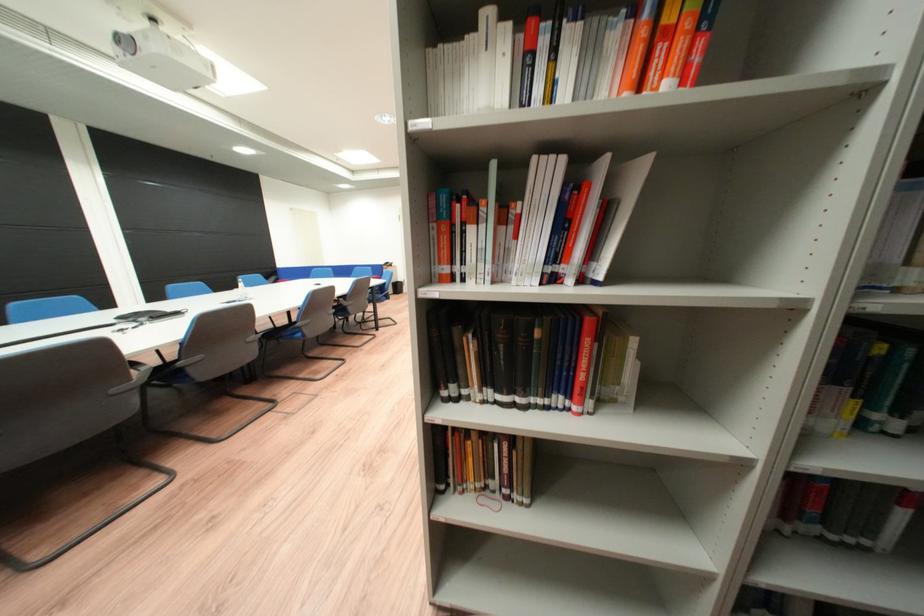
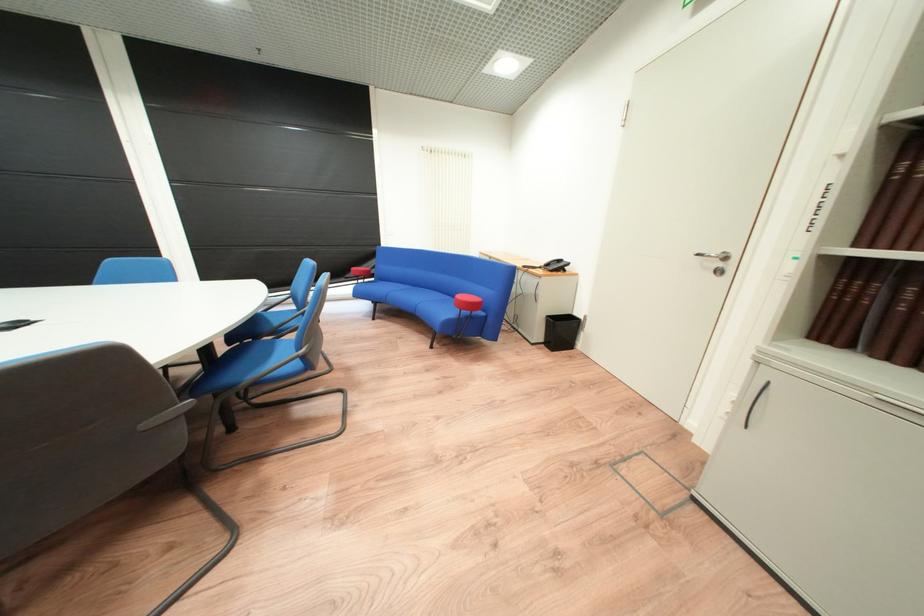
Find the pixel in the second image that matches (408,289) in the first image.

(573, 333)